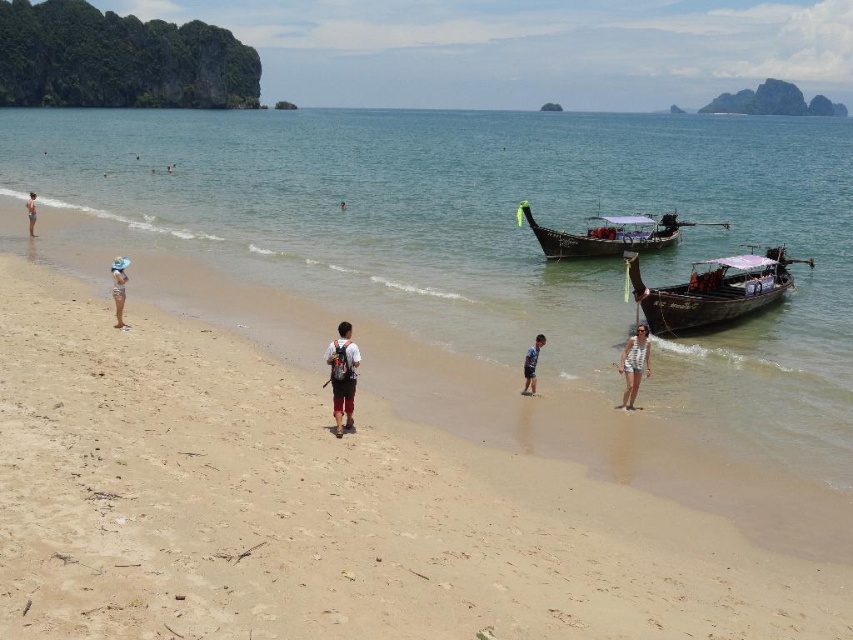
Question: From the image, what is the correct spatial relationship of white striped shorts at lower right in relation to white fabric bag at lower left?

Choices:
 (A) left
 (B) right

Answer: (B)

Question: Is the position of white backpack at center more distant than that of light blue shorts at center?

Choices:
 (A) yes
 (B) no

Answer: (B)

Question: Which object is the closest to the white fabric hat at left?

Choices:
 (A) wooden polished boat at lower right
 (B) white backpack at center
 (C) clear water at beach center
 (D) brown sandy beach at lower left

Answer: (A)

Question: Can you confirm if wooden polished boat at lower right is smaller than white striped shorts at lower right?

Choices:
 (A) yes
 (B) no

Answer: (B)

Question: Among these points, which one is nearest to the camera?

Choices:
 (A) (30, 232)
 (B) (648, 246)

Answer: (B)

Question: Which object is closer to the camera taking this photo?

Choices:
 (A) white fabric hat at left
 (B) white fabric bag at lower left

Answer: (B)